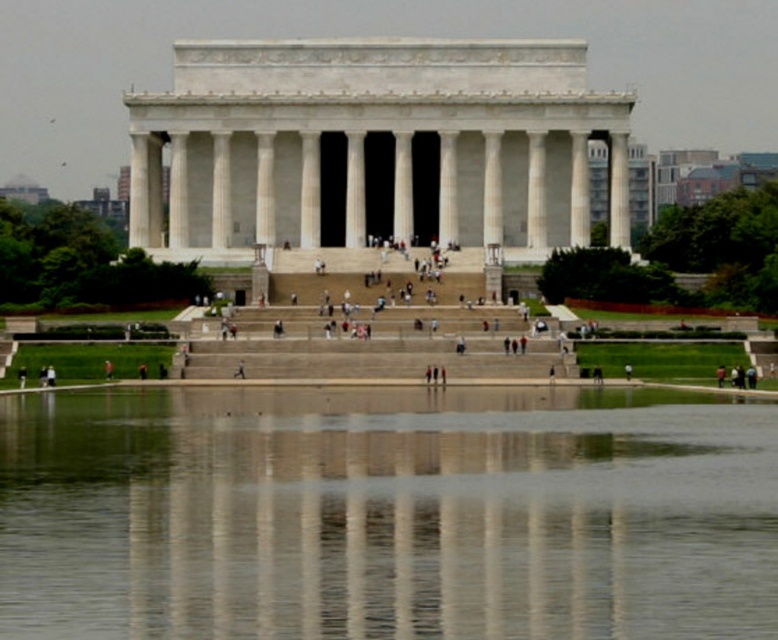
Does point (394, 192) lie behind point (2, 372)?

Yes, point (394, 192) is farther from viewer.

Where is `white marble column at center`? Image resolution: width=778 pixels, height=640 pixels. white marble column at center is located at coordinates (402, 188).

Locate an element on the screen. white marble column at center is located at coordinates (402, 188).

Based on the photo, is clear glass water at center taller than white stone stairs at center?

Correct, clear glass water at center is much taller as white stone stairs at center.

Who is more distant from viewer, (654, 596) or (13, 348)?

Positioned behind is point (13, 348).

The image size is (778, 640). I want to click on clear glass water at center, so click(x=387, y=515).

Between clear glass water at center and white marble column at center, which one appears on the left side from the viewer's perspective?

clear glass water at center

Does clear glass water at center have a lesser height compared to white marble column at center?

Correct, clear glass water at center is not as tall as white marble column at center.

Is point (302, 468) positioned after point (409, 196)?

No, (302, 468) is closer to viewer.

Image resolution: width=778 pixels, height=640 pixels. I want to click on clear glass water at center, so click(x=387, y=515).